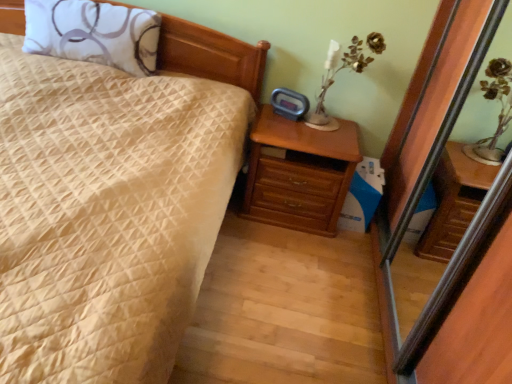
Question: Is wooden chest of drawers at right closer to camera compared to transparent glass screen door at right?

Choices:
 (A) no
 (B) yes

Answer: (A)

Question: From the image's perspective, would you say wooden chest of drawers at right is positioned over transparent glass screen door at right?

Choices:
 (A) yes
 (B) no

Answer: (A)

Question: Is wooden chest of drawers at right to the left of transparent glass screen door at right from the viewer's perspective?

Choices:
 (A) yes
 (B) no

Answer: (A)

Question: Does wooden chest of drawers at right have a greater width compared to transparent glass screen door at right?

Choices:
 (A) no
 (B) yes

Answer: (B)

Question: Is wooden chest of drawers at right thinner than transparent glass screen door at right?

Choices:
 (A) yes
 (B) no

Answer: (B)

Question: Does wooden chest of drawers at right have a larger size compared to transparent glass screen door at right?

Choices:
 (A) yes
 (B) no

Answer: (B)

Question: Is transparent glass screen door at right positioned before white printed pillow at upper left?

Choices:
 (A) yes
 (B) no

Answer: (A)

Question: Is transparent glass screen door at right at the left side of white printed pillow at upper left?

Choices:
 (A) no
 (B) yes

Answer: (A)

Question: Is transparent glass screen door at right facing towards white printed pillow at upper left?

Choices:
 (A) yes
 (B) no

Answer: (A)

Question: Does transparent glass screen door at right have a lesser height compared to white printed pillow at upper left?

Choices:
 (A) yes
 (B) no

Answer: (B)

Question: Is transparent glass screen door at right positioned with its back to white printed pillow at upper left?

Choices:
 (A) yes
 (B) no

Answer: (B)

Question: From a real-world perspective, does transparent glass screen door at right sit lower than white printed pillow at upper left?

Choices:
 (A) no
 (B) yes

Answer: (B)

Question: Does beige quilted bed at center touch transparent glass screen door at right?

Choices:
 (A) yes
 (B) no

Answer: (B)